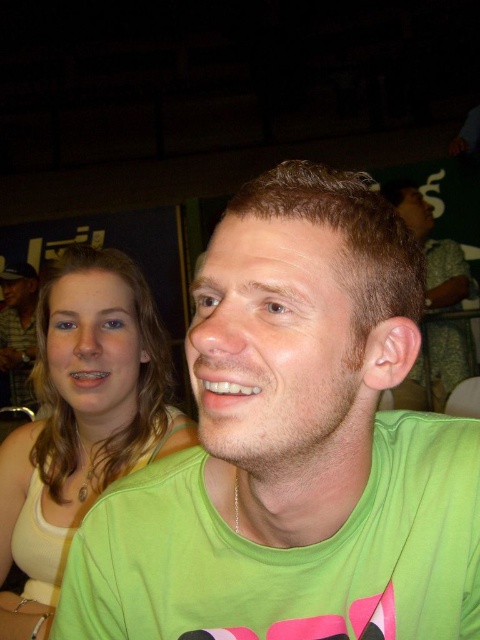
How distant is green fabric shirt at center from green matte shirt at center?

A distance of 6.64 feet exists between green fabric shirt at center and green matte shirt at center.

Does green fabric shirt at center have a greater width compared to green matte shirt at center?

Incorrect, green fabric shirt at center's width does not surpass green matte shirt at center's.

Which is behind, point (277, 428) or point (432, 380)?

The point (432, 380) is more distant.

At what (x,y) coordinates should I click in order to perform the action: click on green fabric shirt at center. Please return your answer as a coordinate pair (x, y). Looking at the image, I should click on (294, 448).

This screenshot has width=480, height=640. What are the coordinates of `green fabric shirt at center` in the screenshot? It's located at (294, 448).

Does green fabric shirt at center lie in front of matte green t-shirt at upper left?

Yes, green fabric shirt at center is in front of matte green t-shirt at upper left.

Describe the element at coordinates (294, 448) in the screenshot. I see `green fabric shirt at center` at that location.

Where is `green fabric shirt at center`? green fabric shirt at center is located at coordinates (294, 448).

Is green fabric shirt at center closer to the viewer compared to light beige tank top at upper left?

That is True.

Which is more to the right, green fabric shirt at center or light beige tank top at upper left?

From the viewer's perspective, green fabric shirt at center appears more on the right side.

Where is `green fabric shirt at center`? This screenshot has height=640, width=480. green fabric shirt at center is located at coordinates (294, 448).